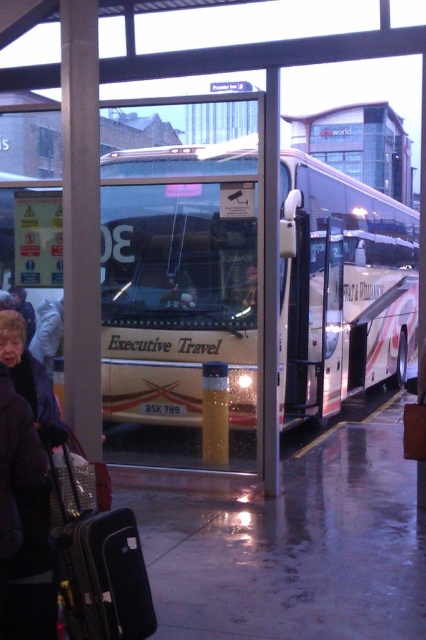
You are a traveler trying to board the white glossy bus at center. There is a black hard suitcase at lower left blocking your path. Can you move the suitcase to access the bus?

The white glossy bus at center occupies less space than the black hard suitcase at lower left, so the suitcase is larger and might be harder to move. However, since the bus itself is smaller in size, you may need to check if there is another path around the suitcase to reach the bus.

You are a passenger who just arrived at the bus station. You need to place your black hard suitcase at lower left near the white glossy bus at center. Can you fit it between the bus and the shelter wall without moving the bus?

The white glossy bus at center is thinner than the black hard suitcase at lower left, so the suitcase may not fit between the bus and the shelter wall if the space is narrower than the suitcase width.